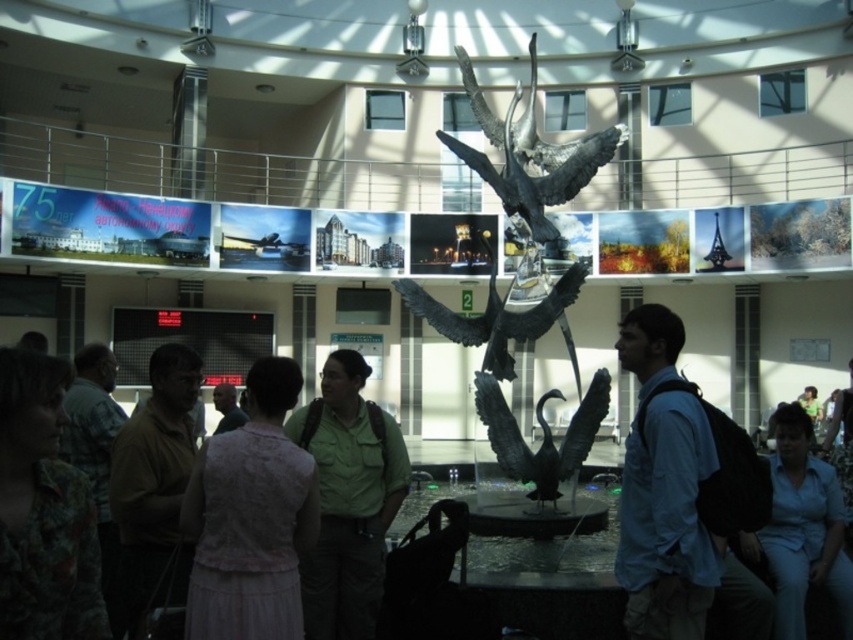
You are standing in the public building and want to locate two specific points marked on the floor. The first point is at coordinate point(10,349) and the second is at point(216,394). Which point is closer to you?

Point(10,349) is closer to the viewer than point(216,394).